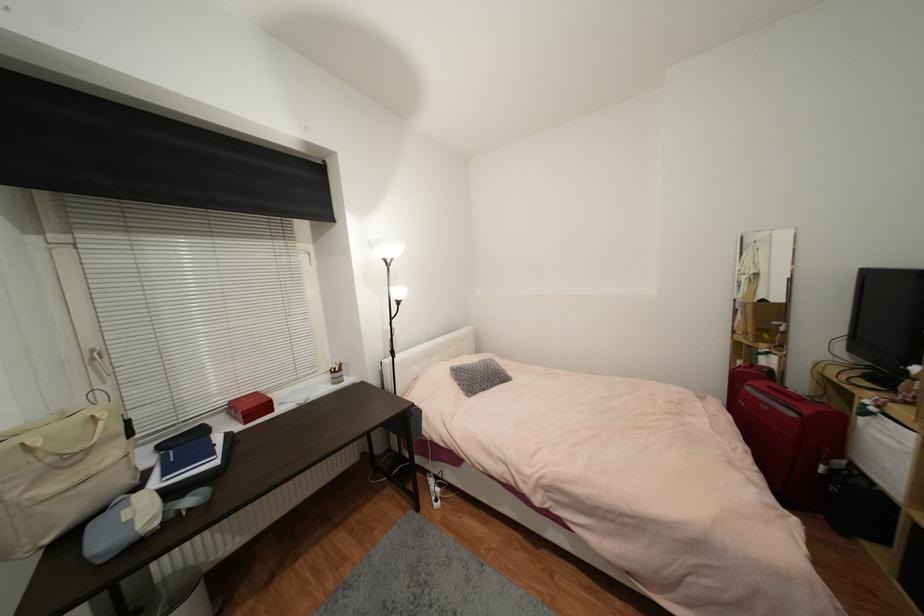
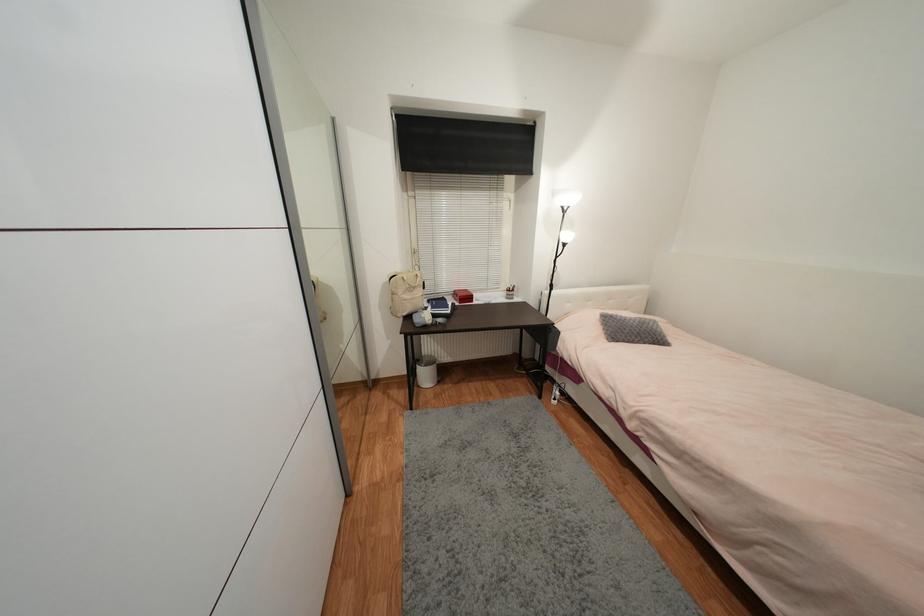
Find the pixel in the second image that matches point 337,373 in the first image.

(513, 292)